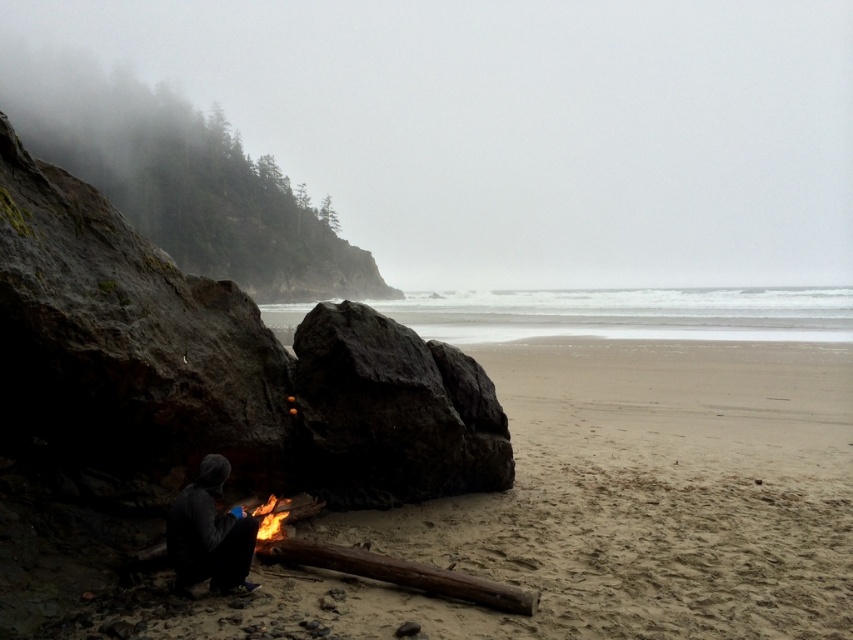
Question: Which object is positioned closest to the dark gray rock at center?

Choices:
 (A) dark gray hoodie at lower left
 (B) smooth sand beach at lower left
 (C) flaming wood at lower center

Answer: (C)

Question: Can you confirm if smooth sand beach at lower left is positioned to the left of dark gray rock at center?

Choices:
 (A) yes
 (B) no

Answer: (B)

Question: Which is nearer to the dark gray rock at center?

Choices:
 (A) flaming wood at lower center
 (B) dark gray hoodie at lower left
 (C) smooth sand beach at lower left

Answer: (A)

Question: Which point is farther from the camera taking this photo?

Choices:
 (A) (207, 490)
 (B) (274, 529)
 (C) (408, 452)
 (D) (476, 611)

Answer: (C)

Question: Where is dark gray rock at center located in relation to flaming wood at lower center in the image?

Choices:
 (A) right
 (B) left

Answer: (A)

Question: Is dark gray hoodie at lower left behind flaming wood at lower center?

Choices:
 (A) yes
 (B) no

Answer: (B)